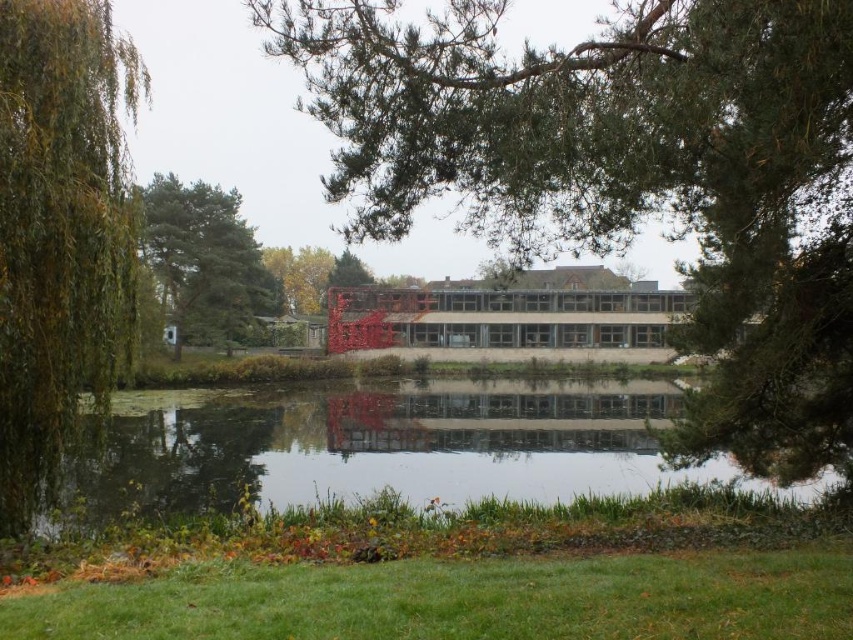
Locate an element on the screen. green grass at lower center is located at coordinates (463, 600).

Between green grass at lower center and green leafy tree at left, which one appears on the right side from the viewer's perspective?

From the viewer's perspective, green grass at lower center appears more on the right side.

At what (x,y) coordinates should I click in order to perform the action: click on green grass at lower center. Please return your answer as a coordinate pair (x, y). Looking at the image, I should click on (463, 600).

Where is `green grass at lower center`? Image resolution: width=853 pixels, height=640 pixels. green grass at lower center is located at coordinates (463, 600).

Does transparent glass water at center come in front of green grass at lower center?

No, it is not.

Does transparent glass water at center appear on the left side of green grass at lower center?

Result: Indeed, transparent glass water at center is positioned on the left side of green grass at lower center.

Is point (404, 424) behind point (73, 609)?

Yes, point (404, 424) is farther from viewer.

Image resolution: width=853 pixels, height=640 pixels. What are the coordinates of `transparent glass water at center` in the screenshot? It's located at (386, 449).

Is point (57, 29) less distant than point (228, 289)?

Yes.

Is green leafy tree at left smaller than green textured pine tree at upper left?

Yes.

Is point (15, 161) positioned after point (258, 275)?

No, (15, 161) is closer to viewer.

At what (x,y) coordinates should I click in order to perform the action: click on green leafy tree at left. Please return your answer as a coordinate pair (x, y). The image size is (853, 640). Looking at the image, I should click on (61, 230).